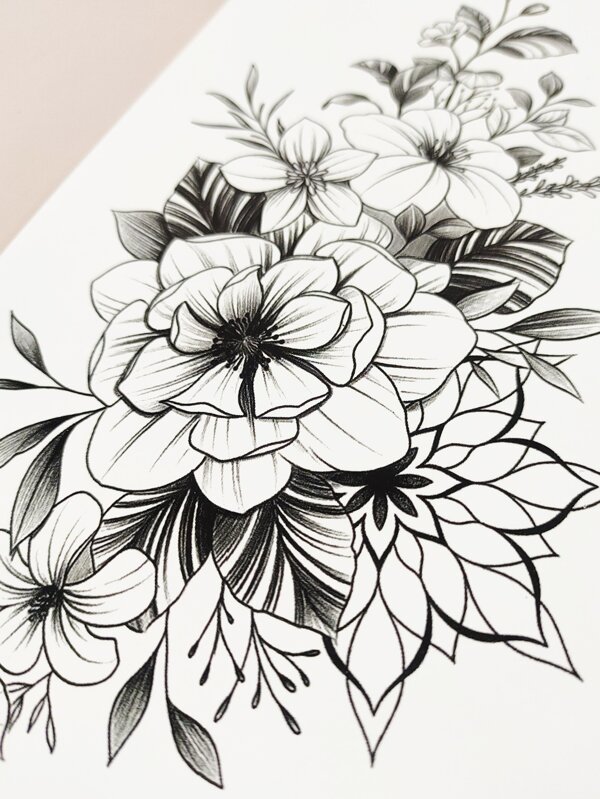
At what (x,y) coordinates should I click in order to perform the action: click on surface. Please return your answer as a coordinate pair (x, y). This screenshot has width=600, height=799. Looking at the image, I should click on click(13, 148).